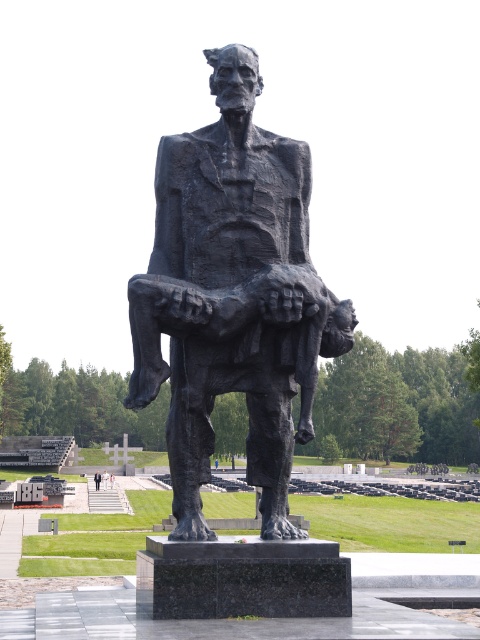
Does light brown wooden person at center appear on the right side of light gray concrete statue at center?

No, light brown wooden person at center is not to the right of light gray concrete statue at center.

Which is more to the left, light brown wooden person at center or light gray concrete statue at center?

From the viewer's perspective, light brown wooden person at center appears more on the left side.

Locate an element on the screen. light brown wooden person at center is located at coordinates (105, 480).

Looking at this image, who is shorter, bronze statue at center or light brown wooden person at center?

With less height is light brown wooden person at center.

Is point (257, 308) in front of point (103, 481)?

Yes, it is.

The image size is (480, 640). What do you see at coordinates (232, 296) in the screenshot?
I see `bronze statue at center` at bounding box center [232, 296].

This screenshot has height=640, width=480. In order to click on bronze statue at center in this screenshot , I will do `click(232, 296)`.

Who is lower down, bronze statue at center or white glossy person at center?

white glossy person at center is below.

Who is higher up, bronze statue at center or white glossy person at center?

Positioned higher is bronze statue at center.

Between point (223, 260) and point (109, 480), which one is positioned in front?

Positioned in front is point (223, 260).

Image resolution: width=480 pixels, height=640 pixels. Find the location of `bronze statue at center`. bronze statue at center is located at coordinates (232, 296).